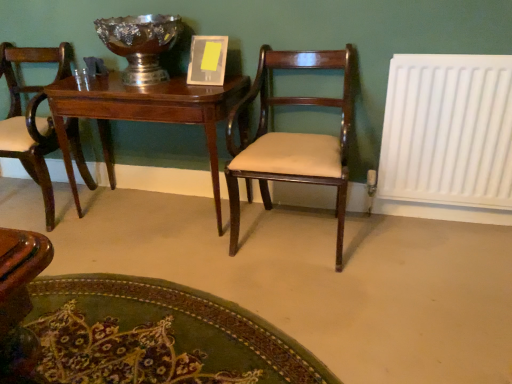
In order to click on vacant space situated on the left part of mahogany wood chair at center, which is the 2th chair in left-to-right order in this screenshot , I will do `click(185, 255)`.